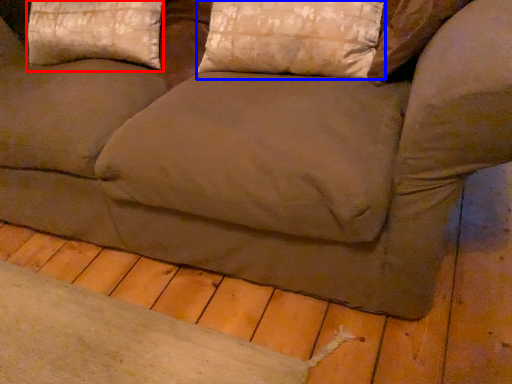
Question: Which point is further to the camera, pillow (highlighted by a red box) or pillow (highlighted by a blue box)?

Choices:
 (A) pillow
 (B) pillow

Answer: (A)